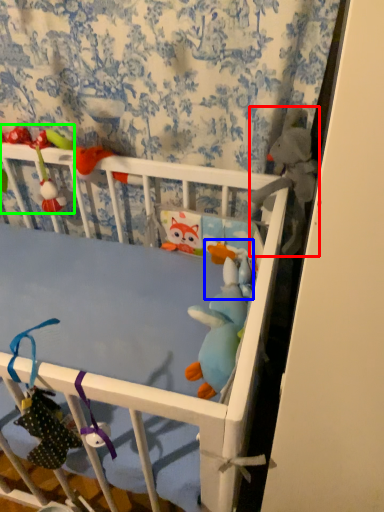
Question: Based on their relative distances, which object is nearer to toy (highlighted by a red box)? Choose from toy (highlighted by a blue box) and toy (highlighted by a green box).

Choices:
 (A) toy
 (B) toy

Answer: (A)